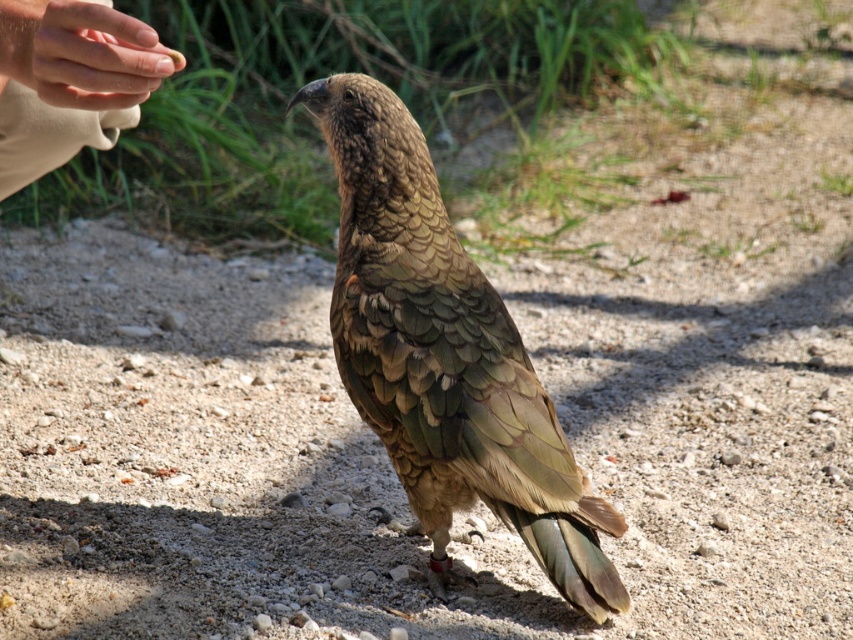
Question: Is brown feathered bird at center in front of skinny tan hand at upper left?

Choices:
 (A) no
 (B) yes

Answer: (A)

Question: Does brown feathered bird at center have a lesser width compared to skinny tan hand at upper left?

Choices:
 (A) no
 (B) yes

Answer: (A)

Question: Which object is closer to the camera taking this photo?

Choices:
 (A) brown feathered bird at center
 (B) smooth skin hand at upper left
 (C) skinny tan hand at upper left

Answer: (B)

Question: Which object appears farthest from the camera in this image?

Choices:
 (A) brown feathered bird at center
 (B) skinny tan hand at upper left

Answer: (A)

Question: Is skinny tan hand at upper left positioned before smooth skin hand at upper left?

Choices:
 (A) yes
 (B) no

Answer: (B)

Question: Estimate the real-world distances between objects in this image. Which object is closer to the smooth skin hand at upper left?

Choices:
 (A) skinny tan hand at upper left
 (B) brown feathered bird at center

Answer: (A)